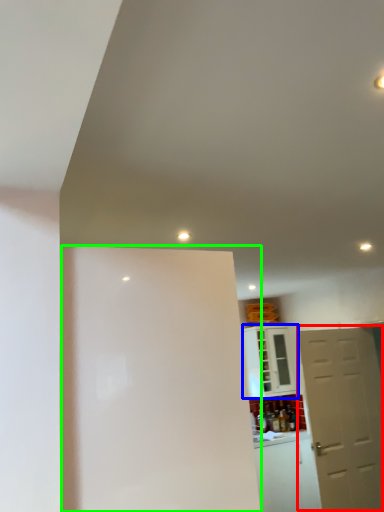
Question: Considering the real-world distances, which object is farthest from door (highlighted by a red box)? cabinetry (highlighted by a blue box) or screen door (highlighted by a green box)?

Choices:
 (A) cabinetry
 (B) screen door

Answer: (B)